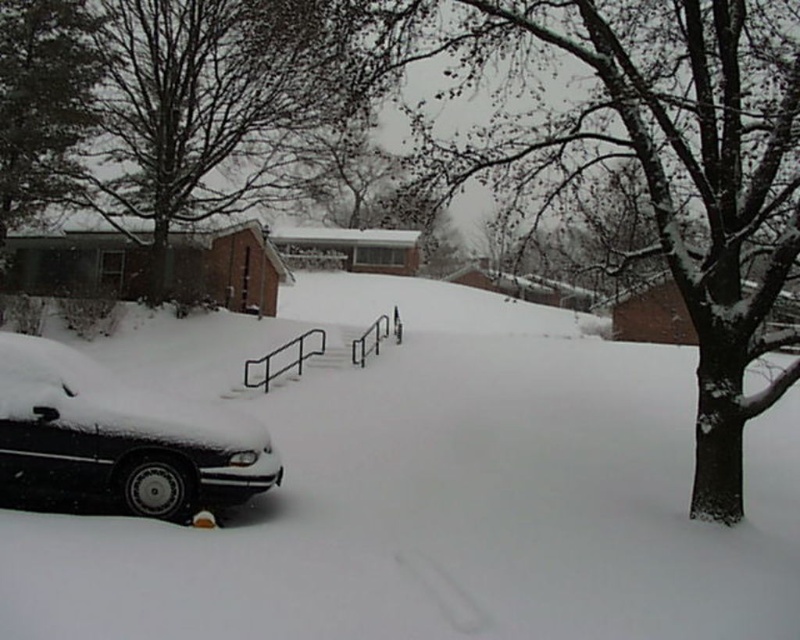
Question: Which of these objects is positioned farthest from the snow-covered tree at upper center?

Choices:
 (A) dark green leafy tree at upper left
 (B) black metal rail at center

Answer: (B)

Question: Which object is positioned farthest from the snow-covered sedan at lower left?

Choices:
 (A) white matte snow at lower left
 (B) snow-covered bark tree at center
 (C) black metal rail at center

Answer: (C)

Question: Does snow-covered sedan at lower left have a greater width compared to dark green leafy tree at upper left?

Choices:
 (A) no
 (B) yes

Answer: (B)

Question: Is dark green leafy tree at upper left below black metal rail at center?

Choices:
 (A) no
 (B) yes

Answer: (A)

Question: Considering the relative positions of snow-covered tree at upper center and dark green leafy tree at upper left in the image provided, where is snow-covered tree at upper center located with respect to dark green leafy tree at upper left?

Choices:
 (A) right
 (B) left

Answer: (A)

Question: Estimate the real-world distances between objects in this image. Which object is farther from the white matte snow at lower left?

Choices:
 (A) snow-covered tree at upper center
 (B) black metal rail at center

Answer: (A)